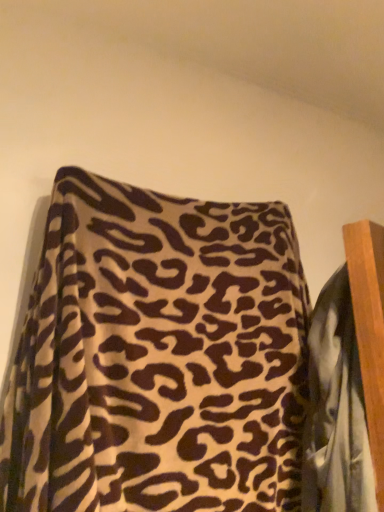
What do you see at coordinates (336, 410) in the screenshot?
I see `leopard print fabric at center` at bounding box center [336, 410].

You are a GUI agent. You are given a task and a screenshot of the screen. Output one action in this format:
    pyautogui.click(x=<x>, y=<y>)
    Task: Click on the leopard print fabric at center
    
    Given the screenshot: What is the action you would take?
    point(336,410)

What is the approximate height of leopard print fabric at upper center?

It is 25.82 inches.

This screenshot has height=512, width=384. I want to click on leopard print fabric at upper center, so click(158, 357).

The width and height of the screenshot is (384, 512). What do you see at coordinates (158, 357) in the screenshot?
I see `leopard print fabric at upper center` at bounding box center [158, 357].

I want to click on leopard print fabric at center, so click(336, 410).

Does leopard print fabric at center appear on the left side of leopard print fabric at upper center?

No, leopard print fabric at center is not to the left of leopard print fabric at upper center.

Does leopard print fabric at center come behind leopard print fabric at upper center?

Yes, leopard print fabric at center is behind leopard print fabric at upper center.

Does point (324, 357) come in front of point (291, 452)?

Yes, point (324, 357) is in front of point (291, 452).

From the image's perspective, which is below, leopard print fabric at center or leopard print fabric at upper center?

leopard print fabric at center, from the image's perspective.

In the scene shown: From a real-world perspective, which is physically below, leopard print fabric at center or leopard print fabric at upper center?

leopard print fabric at center.

Considering the relative sizes of leopard print fabric at center and leopard print fabric at upper center in the image provided, is leopard print fabric at center wider than leopard print fabric at upper center?

In fact, leopard print fabric at center might be narrower than leopard print fabric at upper center.

Can you confirm if leopard print fabric at center is taller than leopard print fabric at upper center?

No.

Is leopard print fabric at center bigger than leopard print fabric at upper center?

Incorrect, leopard print fabric at center is not larger than leopard print fabric at upper center.

Is leopard print fabric at center positioned beyond the bounds of leopard print fabric at upper center?

No, leopard print fabric at center is not outside of leopard print fabric at upper center.

Based on the photo, is the surface of leopard print fabric at center in direct contact with leopard print fabric at upper center?

leopard print fabric at center and leopard print fabric at upper center are clearly separated.

Is leopard print fabric at upper center at the back of leopard print fabric at center?

That's right, leopard print fabric at center is facing away from leopard print fabric at upper center.

Where is `blanket below the leopard print fabric at upper center (from the image's perspective)`? blanket below the leopard print fabric at upper center (from the image's perspective) is located at coordinates (336, 410).

Is leopard print fabric at upper center to the left or to the right of leopard print fabric at center in the image?

Based on their positions, leopard print fabric at upper center is located to the left of leopard print fabric at center.

Considering their positions, is leopard print fabric at upper center located in front of or behind leopard print fabric at center?

Visually, leopard print fabric at upper center is located in front of leopard print fabric at center.

Considering the positions of points (75, 459) and (318, 418), is point (75, 459) farther from camera compared to point (318, 418)?

No, it is in front of (318, 418).

From the image's perspective, is leopard print fabric at upper center positioned above or below leopard print fabric at center?

From the image's perspective, leopard print fabric at upper center appears above leopard print fabric at center.

From a real-world perspective, is leopard print fabric at upper center located beneath leopard print fabric at center?

No, from a real-world perspective, leopard print fabric at upper center is not beneath leopard print fabric at center.

Which object is thinner, leopard print fabric at upper center or leopard print fabric at center?

With smaller width is leopard print fabric at center.

Who is taller, leopard print fabric at upper center or leopard print fabric at center?

leopard print fabric at upper center is taller.

Considering the relative sizes of leopard print fabric at upper center and leopard print fabric at center in the image provided, is leopard print fabric at upper center smaller than leopard print fabric at center?

No.

From the picture: Is leopard print fabric at upper center positioned beyond the bounds of leopard print fabric at center?

Yes, leopard print fabric at upper center is located beyond the bounds of leopard print fabric at center.

Is leopard print fabric at upper center beside leopard print fabric at center?

They are not placed beside each other.

From the picture: Is leopard print fabric at upper center turned away from leopard print fabric at center?

No.

How many degrees apart are the facing directions of leopard print fabric at upper center and leopard print fabric at center?

The angular difference between leopard print fabric at upper center and leopard print fabric at center is 153 degrees.

How distant is leopard print fabric at upper center from leopard print fabric at center?

8.77 inches.

In the image, there is a leopard print fabric at upper center. Where is `blanket below it (from a real-world perspective)`? The image size is (384, 512). blanket below it (from a real-world perspective) is located at coordinates click(336, 410).

Where is `blanket that is behind the leopard print fabric at upper center`? The height and width of the screenshot is (512, 384). blanket that is behind the leopard print fabric at upper center is located at coordinates (336, 410).

The image size is (384, 512). What are the coordinates of `blanket below the leopard print fabric at upper center (from the image's perspective)` in the screenshot? It's located at (336, 410).